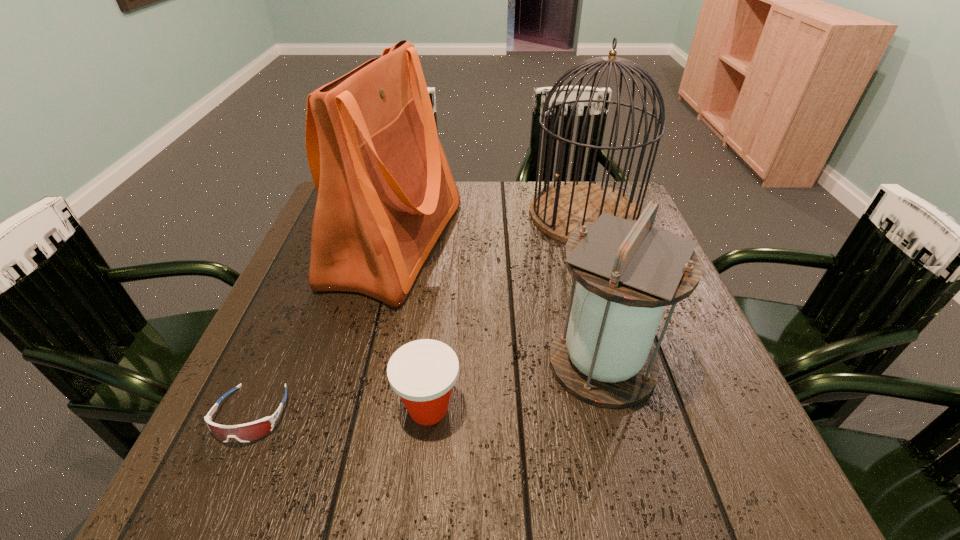
Where is `birdcage at the far edge`? The height and width of the screenshot is (540, 960). birdcage at the far edge is located at coordinates (559, 210).

Find the location of a particular element. Image resolution: width=960 pixels, height=540 pixels. shopping bag located in the far edge section of the desktop is located at coordinates (385, 190).

The width and height of the screenshot is (960, 540). Identify the location of shopping bag that is positioned at the left edge. (385, 190).

Find the location of a particular element. Image resolution: width=960 pixels, height=540 pixels. goggles that is at the left edge is located at coordinates (247, 432).

This screenshot has width=960, height=540. In order to click on birdcage that is positioned at the right edge in this screenshot , I will do [559, 210].

Where is `lantern present at the right edge`? The width and height of the screenshot is (960, 540). lantern present at the right edge is located at coordinates (627, 271).

The height and width of the screenshot is (540, 960). Identify the location of object that is at the far left corner. 385,190.

The image size is (960, 540). Identify the location of object present at the far right corner. (559, 210).

At what (x,y) coordinates should I click in order to perform the action: click on free region at the far edge. Please return your answer as a coordinate pair (x, y). The height and width of the screenshot is (540, 960). Looking at the image, I should click on (511, 215).

Image resolution: width=960 pixels, height=540 pixels. In the image, there is a desktop. Find the location of `vacant space at the near edge`. vacant space at the near edge is located at coordinates (349, 454).